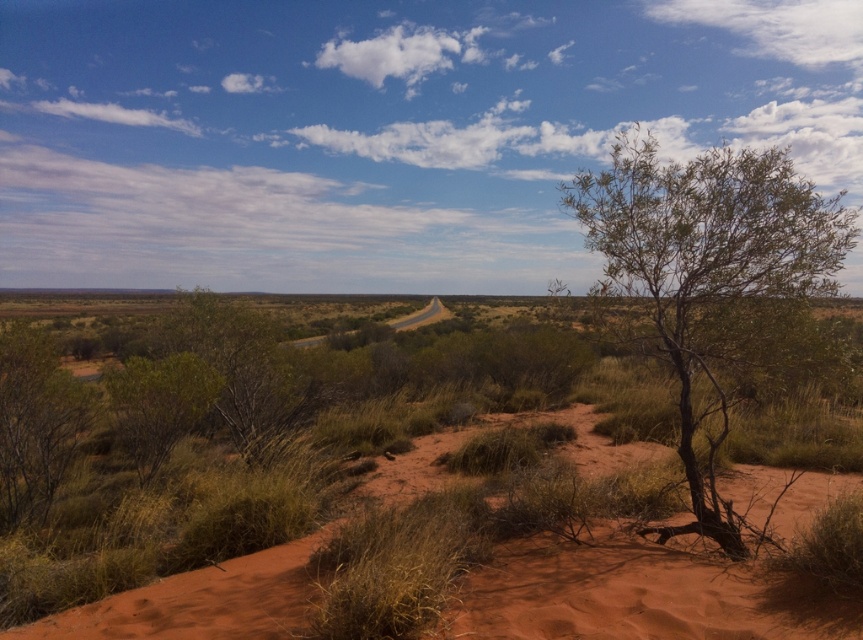
Can you confirm if green leafy tree at right is positioned to the right of green leafy shrub at left?

Yes, green leafy tree at right is to the right of green leafy shrub at left.

Identify the location of green leafy tree at right. (709, 278).

Measure the distance between point [489,609] and camera.

Point [489,609] is 13.47 feet from camera.

Is point (693, 620) positioned before point (10, 380)?

Yes, it is.

Identify the location of dried reddish-brown dirt track at center. (638, 593).

Does dried reddish-brown dirt track at center have a lesser width compared to green leafy tree at right?

Indeed, dried reddish-brown dirt track at center has a lesser width compared to green leafy tree at right.

Identify the location of dried reddish-brown dirt track at center. (638, 593).

The height and width of the screenshot is (640, 863). What do you see at coordinates (638, 593) in the screenshot? I see `dried reddish-brown dirt track at center` at bounding box center [638, 593].

You are a GUI agent. You are given a task and a screenshot of the screen. Output one action in this format:
    pyautogui.click(x=<x>, y=<y>)
    Task: Click on the dried reddish-brown dirt track at center
    The image size is (863, 640).
    Given the screenshot: What is the action you would take?
    pyautogui.click(x=638, y=593)